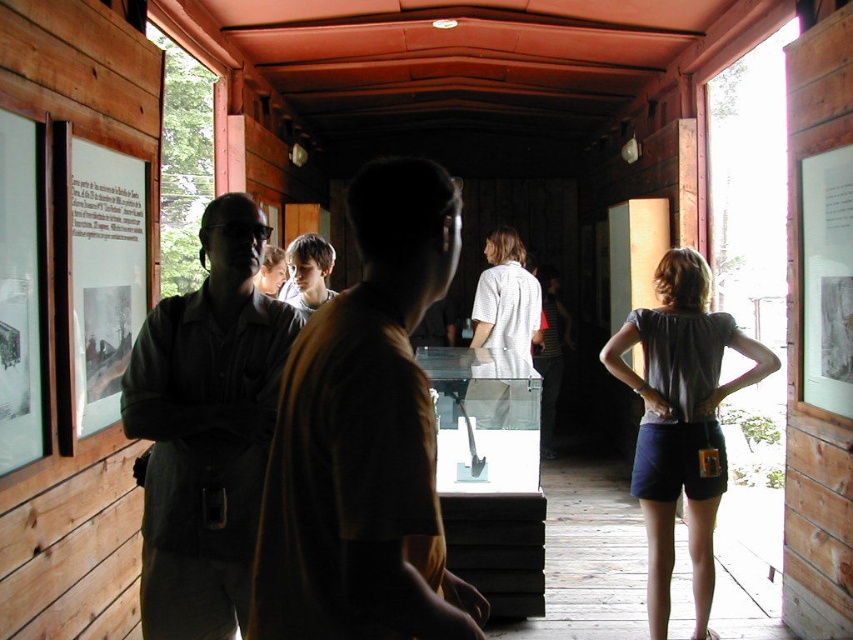
You are an artist standing in the museum and want to sketch the white matte shirt at center and the light brown hair at center. Which object should you focus on first to ensure you capture their positions accurately?

You should focus on the white matte shirt at center first because the light brown hair at center is behind it, so capturing the shirt first will establish the foreground before detailing the background elements.

You are a tailor working in this museum and need to determine which shirt to display in a narrow display case. The case can only accommodate shirts with a width of up to 30 cm. Given the brown shirt at center and the matte black shirt at center, which one is more likely to fit in the case?

The matte black shirt at center is more likely to fit in the display case since its width is smaller than the brown shirt at center, which exceeds the 30 cm limit.